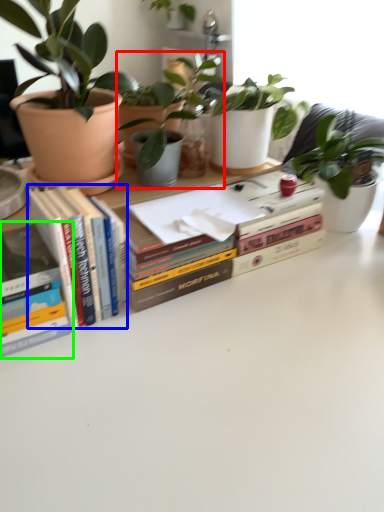
Question: Considering the real-world distances, which object is farthest from houseplant (highlighted by a red box)? book (highlighted by a blue box) or book (highlighted by a green box)?

Choices:
 (A) book
 (B) book

Answer: (B)